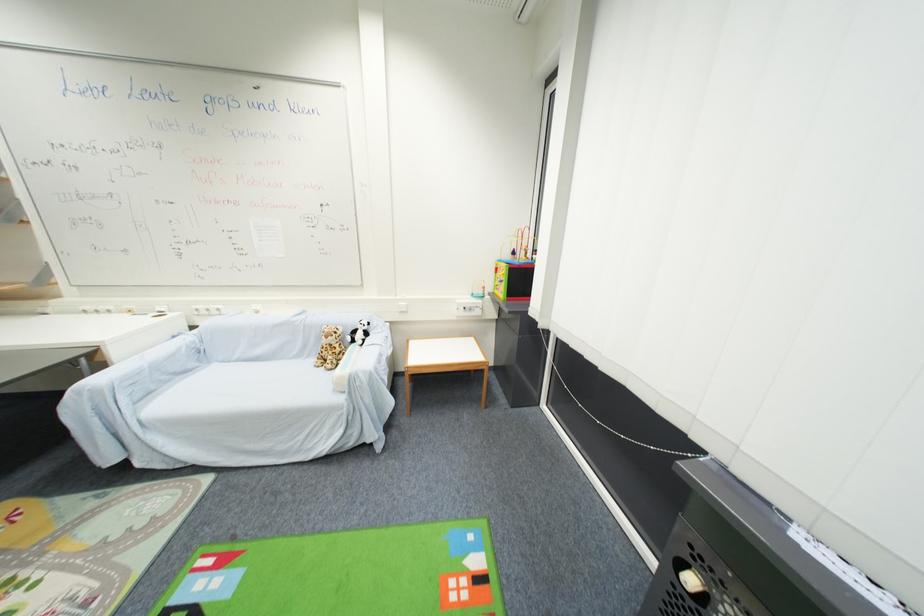
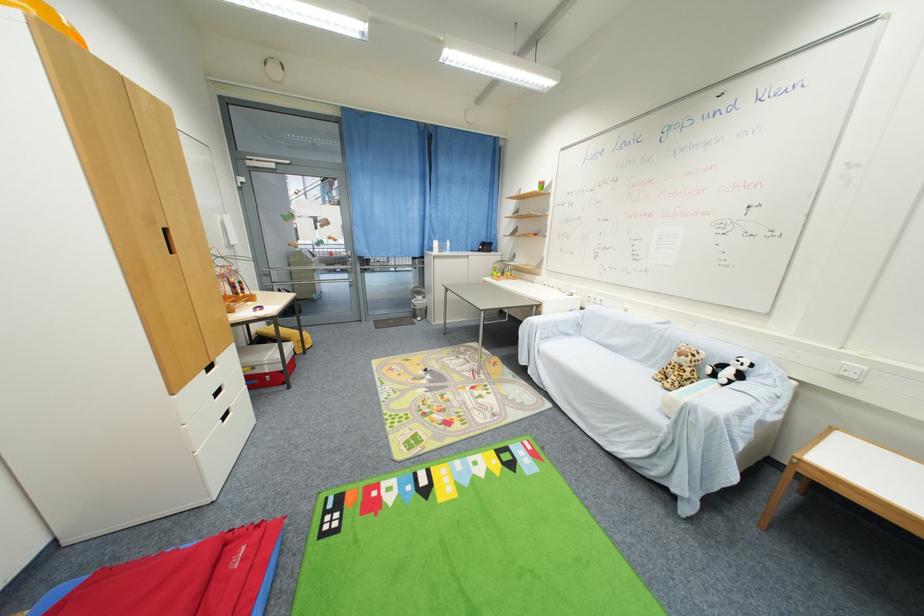
In the second image, find the point that corresponds to [333,363] in the first image.

(675, 382)